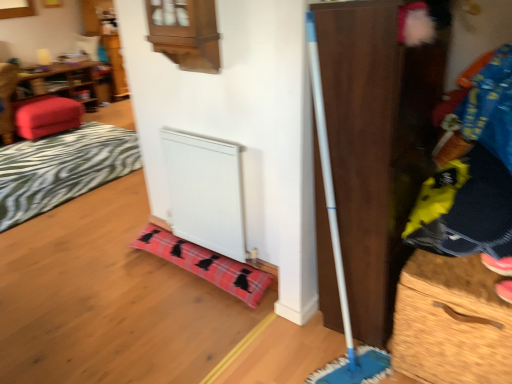
Question: Is velvet red ottoman at left wider than white matte radiator at lower center?

Choices:
 (A) no
 (B) yes

Answer: (B)

Question: Is velvet red ottoman at left behind white matte radiator at lower center?

Choices:
 (A) yes
 (B) no

Answer: (A)

Question: Is velvet red ottoman at left next to white matte radiator at lower center?

Choices:
 (A) yes
 (B) no

Answer: (B)

Question: Would you say velvet red ottoman at left is outside white matte radiator at lower center?

Choices:
 (A) no
 (B) yes

Answer: (B)

Question: Is the position of velvet red ottoman at left less distant than that of white matte radiator at lower center?

Choices:
 (A) yes
 (B) no

Answer: (B)

Question: Does velvet red ottoman at left turn towards white matte radiator at lower center?

Choices:
 (A) no
 (B) yes

Answer: (B)

Question: Can you confirm if plaid fabric blanket at lower center, which ranks as the 1th blanket in bottom-to-top order, is wider than wooden drawer at right?

Choices:
 (A) no
 (B) yes

Answer: (A)

Question: Considering the relative sizes of plaid fabric blanket at lower center, which is the second blanket from left to right, and wooden drawer at right in the image provided, is plaid fabric blanket at lower center, which is the second blanket from left to right, smaller than wooden drawer at right?

Choices:
 (A) no
 (B) yes

Answer: (B)

Question: Is there a large distance between plaid fabric blanket at lower center, which is the second blanket from left to right, and wooden drawer at right?

Choices:
 (A) no
 (B) yes

Answer: (A)

Question: Is wooden drawer at right completely or partially inside plaid fabric blanket at lower center, placed as the second blanket when sorted from top to bottom?

Choices:
 (A) yes
 (B) no

Answer: (B)

Question: Is plaid fabric blanket at lower center, positioned as the 1th blanket in right-to-left order, thinner than wooden drawer at right?

Choices:
 (A) yes
 (B) no

Answer: (A)

Question: From the image's perspective, is plaid fabric blanket at lower center, arranged as the 1th blanket when viewed from the front, located above wooden drawer at right?

Choices:
 (A) no
 (B) yes

Answer: (B)

Question: From a real-world perspective, is wooden dresser at right beneath plaid fabric blanket at lower center, placed as the second blanket when sorted from top to bottom?

Choices:
 (A) no
 (B) yes

Answer: (A)